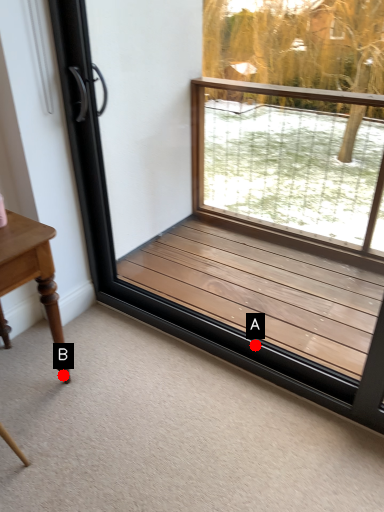
Question: Two points are circled on the image, labeled by A and B beside each circle. Which point appears farthest from the camera in this image?

Choices:
 (A) A is further
 (B) B is further

Answer: (A)